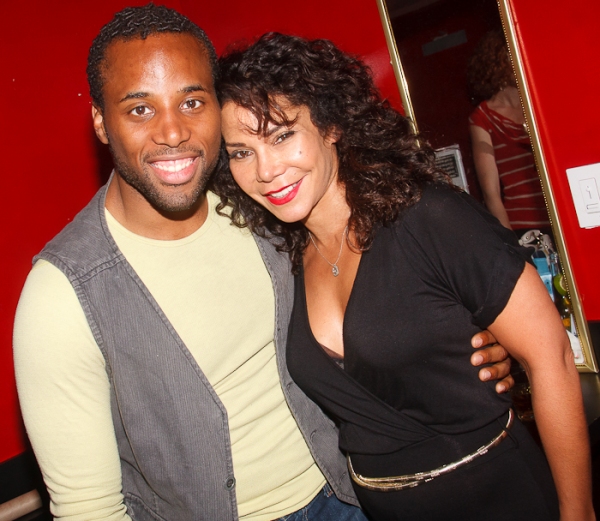
The image size is (600, 521). I want to click on red wall, so click(x=590, y=263).